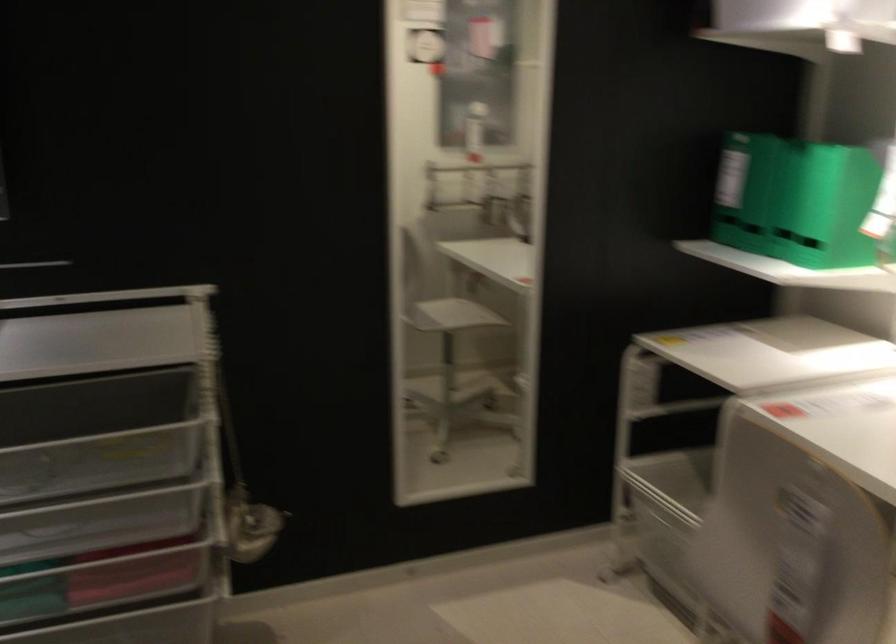
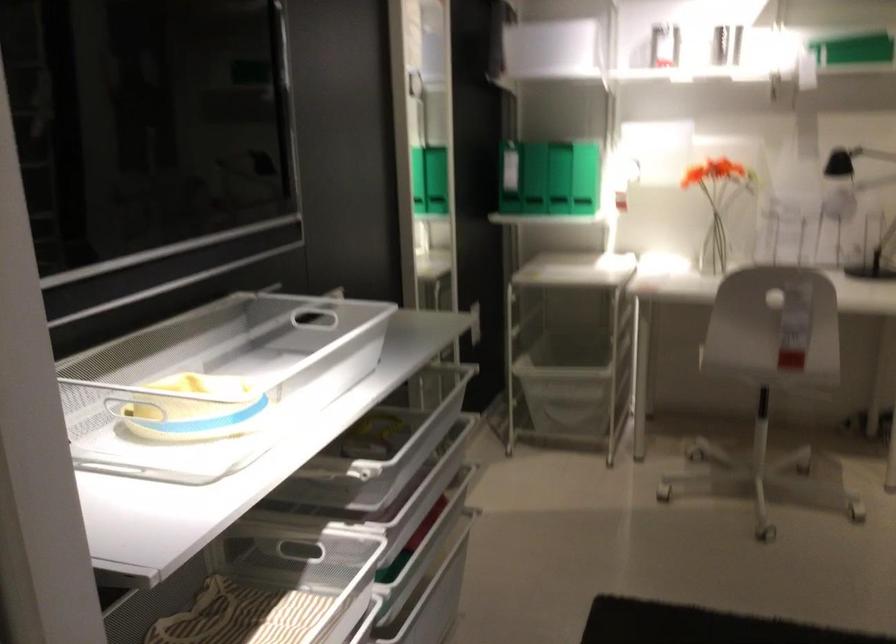
Locate, in the second image, the point that corresponds to [777,211] in the first image.

(558, 178)